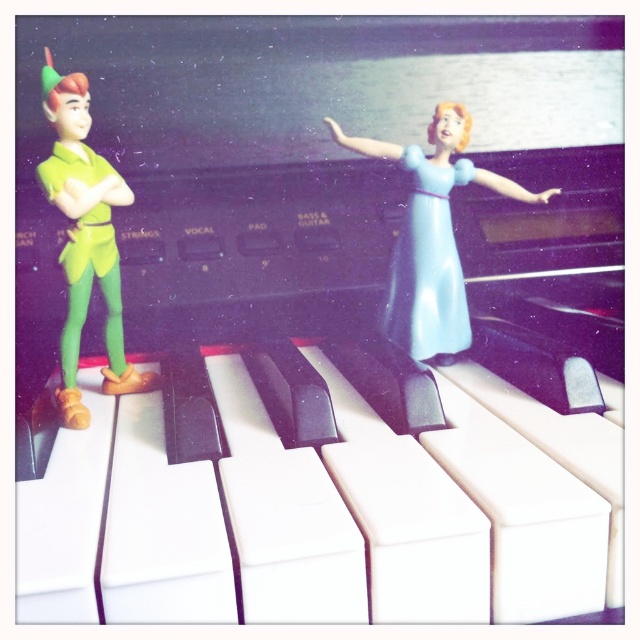
Question: Which point is farther to the camera?

Choices:
 (A) (120, 323)
 (B) (451, 321)

Answer: (B)

Question: In this image, where is light blue plastic figure at center located relative to light blue plastic dress at center?

Choices:
 (A) above
 (B) below

Answer: (A)

Question: Is light blue plastic figure at center smaller than green matte peter pan figurine at left?

Choices:
 (A) no
 (B) yes

Answer: (A)

Question: Which point appears farthest from the camera in this image?

Choices:
 (A) (83, 209)
 (B) (438, 314)

Answer: (B)

Question: Can you confirm if light blue plastic figure at center is positioned to the right of green matte peter pan figurine at left?

Choices:
 (A) no
 (B) yes

Answer: (B)

Question: Which object appears closest to the camera in this image?

Choices:
 (A) green matte peter pan figurine at left
 (B) light blue plastic dress at center
 (C) light blue plastic figure at center

Answer: (A)